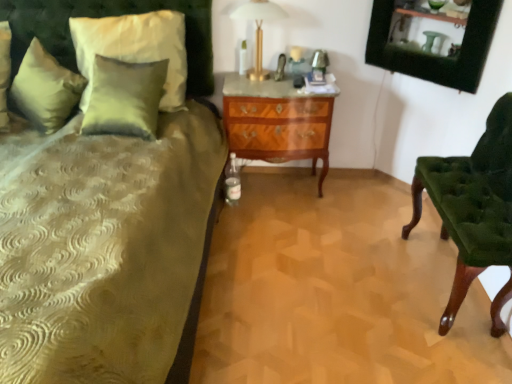
This screenshot has width=512, height=384. Identify the location of vacant space underneath mahogany wood drawer at center (from a real-world perspective). (274, 184).